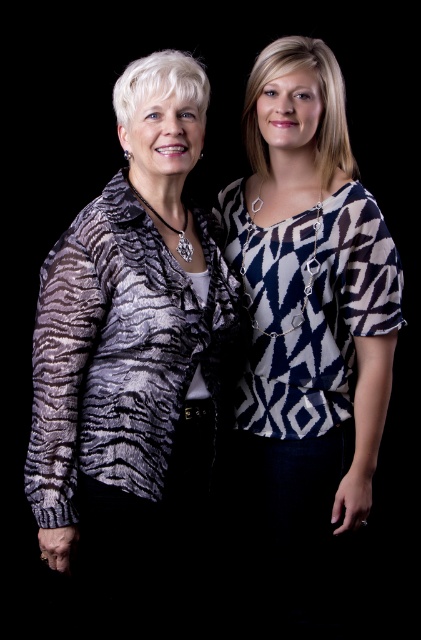
You are an assistant helping someone choose an outfit for a formal event. They have two options from the image described. The first is the zebra print jacket at left and the second is the textured black and white sweater at left. Which of these two items would be more appropriate for a formal event?

The zebra print jacket at left is located above the textured black and white sweater at left, suggesting it is the outer layer. For a formal event, the zebra print jacket at left would be more appropriate as outerwear, while the textured black and white sweater at left could serve as an elegant underlayer.

You are an assistant helping someone choose an outfit. They want to wear both the zebra print jacket at left and the textured black and white sweater at left. Which one should be worn over the other?

The zebra print jacket at left should be worn over the textured black and white sweater at left because it is positioned to the left of it, indicating layering order.

You are a photographer trying to capture the zebra print jacket at left and the textured black and white sweater at left in a photo. Since both are on the same person, can you see the entire sweater underneath the jacket?

The zebra print jacket at left is in front of the textured black and white sweater at left, so only parts of the sweater may be visible where the jacket does not cover it.